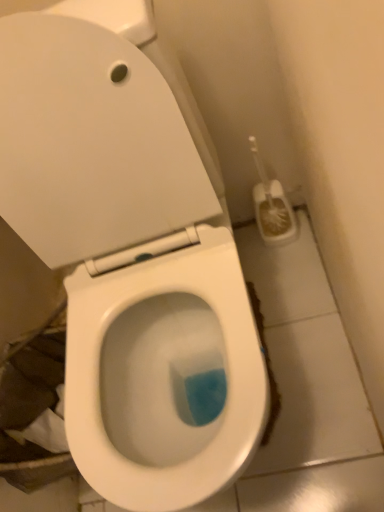
From the picture: In order to face white glossy toilet at center, should I rotate leftwards or rightwards?

Turn left approximately 6.406 degrees to face it.

Image resolution: width=384 pixels, height=512 pixels. What do you see at coordinates (128, 261) in the screenshot?
I see `white glossy toilet at center` at bounding box center [128, 261].

Find the location of a particular element. This screenshot has height=512, width=384. white glossy toilet at center is located at coordinates (128, 261).

What do you see at coordinates (271, 205) in the screenshot? I see `white plastic toilet brush at right` at bounding box center [271, 205].

Measure the distance between point (270, 224) and camera.

Point (270, 224) and camera are 1.22 meters apart from each other.

The width and height of the screenshot is (384, 512). I want to click on white plastic toilet brush at right, so click(271, 205).

Where is `white glossy toilet at center`? white glossy toilet at center is located at coordinates [x=128, y=261].

Considering the relative positions of white plastic toilet brush at right and white glossy toilet at center in the image provided, is white plastic toilet brush at right to the left of white glossy toilet at center from the viewer's perspective?

In fact, white plastic toilet brush at right is to the right of white glossy toilet at center.

Which is behind, white plastic toilet brush at right or white glossy toilet at center?

Positioned behind is white plastic toilet brush at right.

Is point (287, 215) in front of point (77, 144)?

No.

From the image's perspective, who appears lower, white plastic toilet brush at right or white glossy toilet at center?

white glossy toilet at center.

From a real-world perspective, who is located lower, white plastic toilet brush at right or white glossy toilet at center?

From a 3D spatial view, white plastic toilet brush at right is below.

Between white plastic toilet brush at right and white glossy toilet at center, which one has larger width?

white glossy toilet at center.

Considering the sizes of objects white plastic toilet brush at right and white glossy toilet at center in the image provided, who is taller, white plastic toilet brush at right or white glossy toilet at center?

white glossy toilet at center.

Which of these two, white plastic toilet brush at right or white glossy toilet at center, is bigger?

white glossy toilet at center is bigger.

In the scene shown: Does white plastic toilet brush at right contain white glossy toilet at center?

No, white plastic toilet brush at right does not contain white glossy toilet at center.

Is white plastic toilet brush at right beside white glossy toilet at center?

No, white plastic toilet brush at right is not next to white glossy toilet at center.

Is white plastic toilet brush at right oriented towards white glossy toilet at center?

No, white plastic toilet brush at right is not facing towards white glossy toilet at center.

Find the location of a particular element. The height and width of the screenshot is (512, 384). toilet on the left of white plastic toilet brush at right is located at coordinates (128, 261).

Considering the relative positions of white glossy toilet at center and white plastic toilet brush at right in the image provided, is white glossy toilet at center to the left of white plastic toilet brush at right from the viewer's perspective?

Correct, you'll find white glossy toilet at center to the left of white plastic toilet brush at right.

Is white glossy toilet at center further to camera compared to white plastic toilet brush at right?

No.

Is point (214, 471) farther from viewer compared to point (283, 214)?

That is False.

From the image's perspective, is white glossy toilet at center located above or below white plastic toilet brush at right?

white glossy toilet at center is below white plastic toilet brush at right.

From a real-world perspective, who is located higher, white glossy toilet at center or white plastic toilet brush at right?

white glossy toilet at center.

Based on the photo, does white glossy toilet at center have a greater width compared to white plastic toilet brush at right?

Correct, the width of white glossy toilet at center exceeds that of white plastic toilet brush at right.

Between white glossy toilet at center and white plastic toilet brush at right, which one has less height?

white plastic toilet brush at right is shorter.

In the scene shown: Which of these two, white glossy toilet at center or white plastic toilet brush at right, is smaller?

Smaller between the two is white plastic toilet brush at right.

Is white glossy toilet at center outside of white plastic toilet brush at right?

That's correct, white glossy toilet at center is outside of white plastic toilet brush at right.

In the scene shown: Are white glossy toilet at center and white plastic toilet brush at right located far from each other?

No, white glossy toilet at center is in close proximity to white plastic toilet brush at right.

Is white glossy toilet at center oriented away from white plastic toilet brush at right?

No, white glossy toilet at center is not facing the opposite direction of white plastic toilet brush at right.

Find the location of a particular element. The height and width of the screenshot is (512, 384). brush below the white glossy toilet at center (from a real-world perspective) is located at coordinates click(271, 205).

Find the location of a particular element. toilet below the white plastic toilet brush at right (from the image's perspective) is located at coordinates (128, 261).

Where is `brush lying behind the white glossy toilet at center`? The width and height of the screenshot is (384, 512). brush lying behind the white glossy toilet at center is located at coordinates (271, 205).